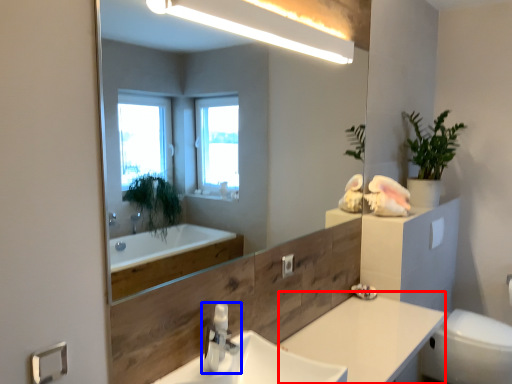
Question: Among these objects, which one is nearest to the camera, counter top (highlighted by a red box) or tap (highlighted by a blue box)?

Choices:
 (A) counter top
 (B) tap

Answer: (B)